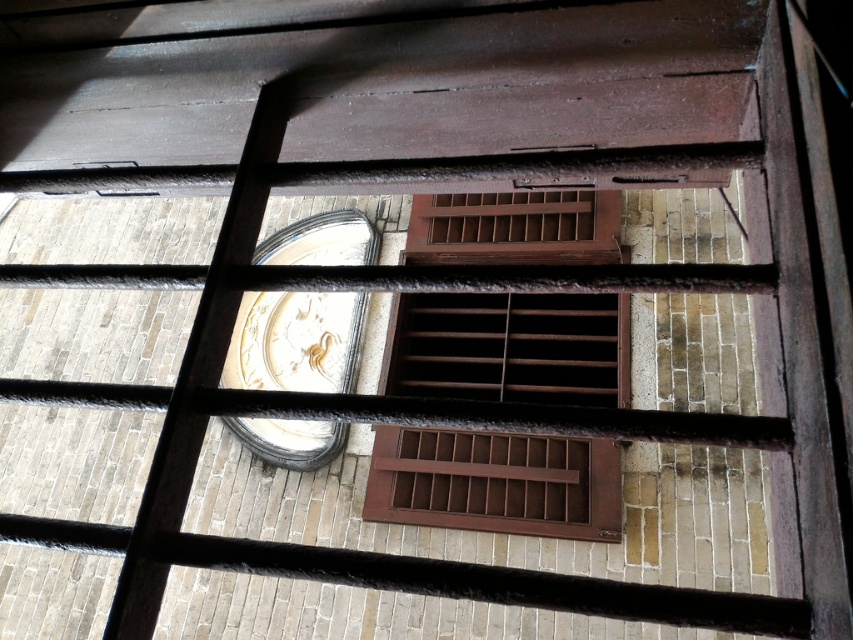
You are standing in front of a metal grate with horizontal and vertical bars. You notice a point marked at coordinates (509, 348). What object does this point indicate?

The point marks a brown wooden window at center.